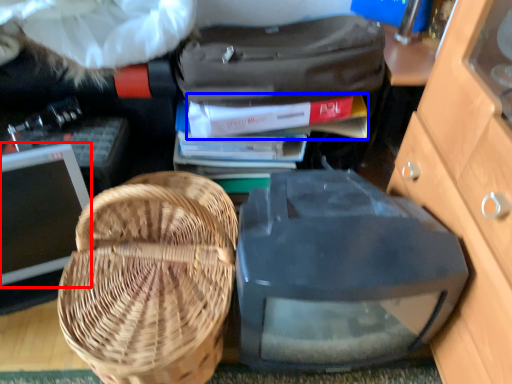
Question: Which point is closer to the camera, computer monitor (highlighted by a red box) or book (highlighted by a blue box)?

Choices:
 (A) computer monitor
 (B) book

Answer: (A)